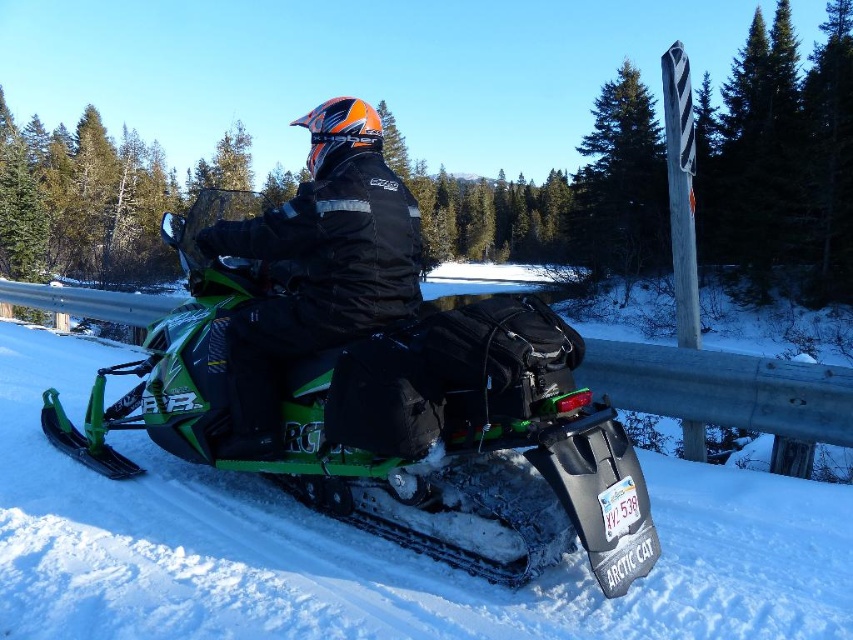
Question: Does green matte snowmobile at center have a smaller size compared to black matte jacket at center?

Choices:
 (A) no
 (B) yes

Answer: (A)

Question: Is green matte snowmobile at center to the right of black matte jacket at center from the viewer's perspective?

Choices:
 (A) no
 (B) yes

Answer: (A)

Question: In this image, where is green matte snowmobile at center located relative to black matte jacket at center?

Choices:
 (A) left
 (B) right

Answer: (A)

Question: Which of the following is the farthest from the observer?

Choices:
 (A) green matte snowmobile at center
 (B) black matte jacket at center

Answer: (B)